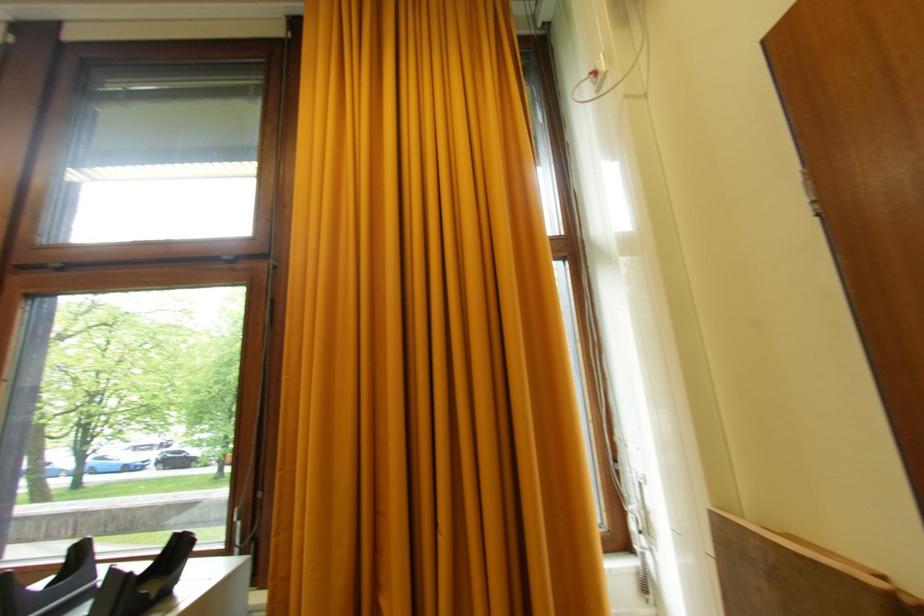
The height and width of the screenshot is (616, 924). Find the location of `red light switch`. red light switch is located at coordinates (596, 76).